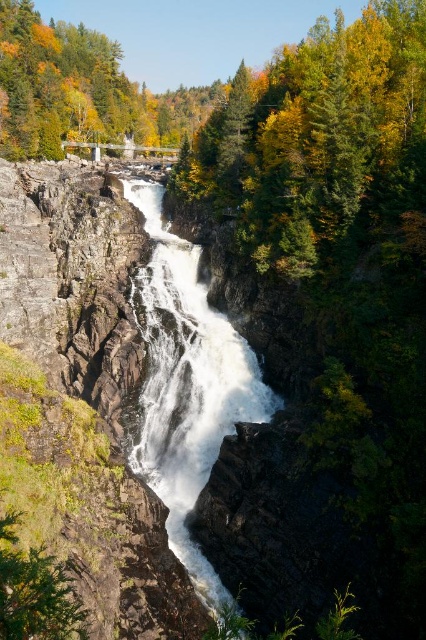
Consider the image. You are a hiker standing at the edge of the valley looking at the green leafy tree at upper center and the white frothy water at center. Which object is located higher in the scene?

The green leafy tree at upper center is positioned over the white frothy water at center, so it is higher in the scene.

You are a hiker standing at the edge of the valley looking at the green leafy tree at upper center and the white frothy water at center. Which object appears wider from your perspective?

The green leafy tree at upper center appears wider than the white frothy water at center because its width is larger according to the description.